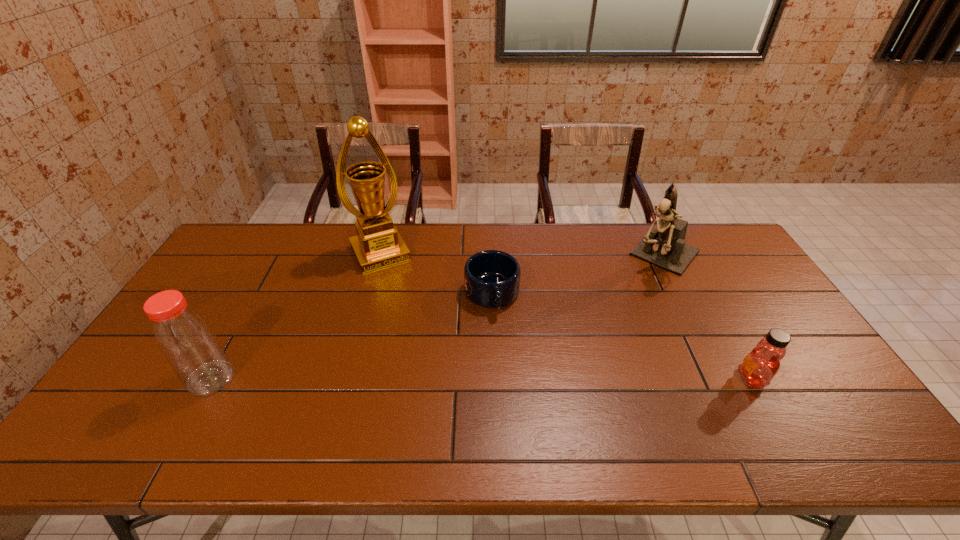
Find the location of `the third tallest object`. the third tallest object is located at coordinates (185, 338).

Image resolution: width=960 pixels, height=540 pixels. I want to click on bottle, so click(185, 338).

Image resolution: width=960 pixels, height=540 pixels. Find the location of `the second shortest object`. the second shortest object is located at coordinates (759, 367).

I want to click on the tallest object, so click(378, 244).

Locate an element on the screen. award is located at coordinates (378, 244).

This screenshot has height=540, width=960. Find the location of `the second tallest object`. the second tallest object is located at coordinates (665, 247).

Image resolution: width=960 pixels, height=540 pixels. In order to click on the shortest object in this screenshot , I will do `click(491, 278)`.

I want to click on mug, so click(491, 278).

I want to click on vacant area located on the back of the leftmost object, so click(x=246, y=315).

Find the location of a particular element. vacant space located 0.110m on the front label of the honey is located at coordinates (695, 379).